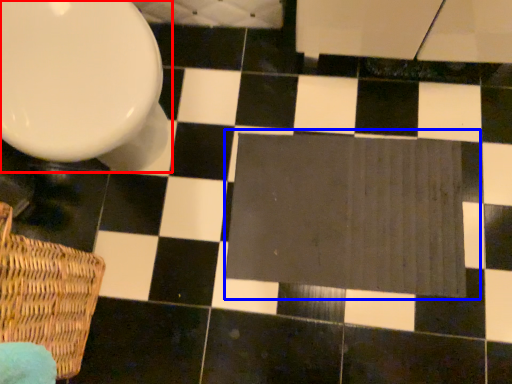
Question: Among these objects, which one is nearest to the camera, toilet (highlighted by a red box) or bath mat (highlighted by a blue box)?

Choices:
 (A) toilet
 (B) bath mat

Answer: (A)